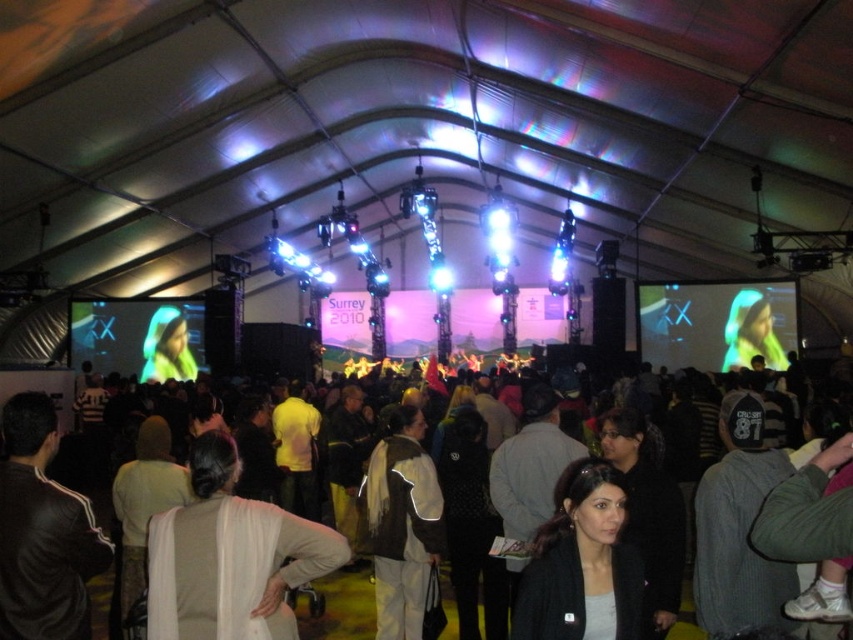
You are a photographer at the event and need to capture a clear photo of both the black mesh dress at center and the matte black jacket at center. Which object should you focus on first to ensure it appears in focus, considering their heights?

The black mesh dress at center is taller than the matte black jacket at center, so you should focus on the black mesh dress at center first to ensure proper focus.